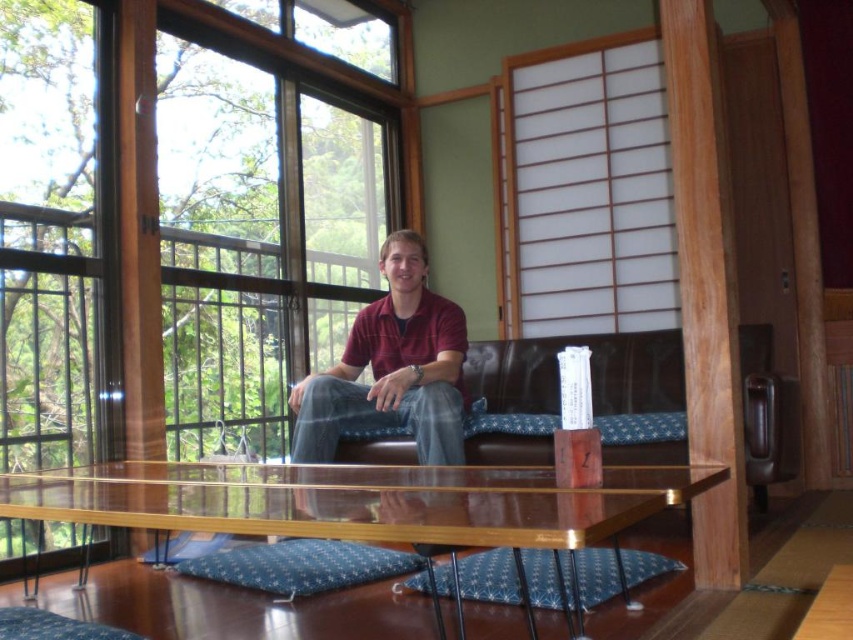
Who is positioned more to the left, transparent glass table at center or white paper screen at upper right?

Positioned to the left is transparent glass table at center.

Is point (463, 515) closer to viewer compared to point (556, 301)?

Yes, it is in front of point (556, 301).

The image size is (853, 640). What do you see at coordinates (360, 500) in the screenshot?
I see `transparent glass table at center` at bounding box center [360, 500].

The width and height of the screenshot is (853, 640). Identify the location of transparent glass table at center. (360, 500).

Can you confirm if transparent glass table at center is positioned above brown leather couch at center?

Actually, transparent glass table at center is below brown leather couch at center.

Which is more to the right, transparent glass table at center or brown leather couch at center?

From the viewer's perspective, brown leather couch at center appears more on the right side.

Who is more distant from viewer, (519, 515) or (779, 403)?

Point (779, 403)

Where is `transparent glass table at center`? This screenshot has height=640, width=853. transparent glass table at center is located at coordinates (360, 500).

In the scene shown: Can you confirm if clear glass window at upper left is taller than white paper screen at upper right?

Correct, clear glass window at upper left is much taller as white paper screen at upper right.

Which is in front, point (363, 184) or point (527, 180)?

Point (527, 180) is more forward.

Find the location of a particular element. Image resolution: width=853 pixels, height=640 pixels. clear glass window at upper left is located at coordinates (186, 220).